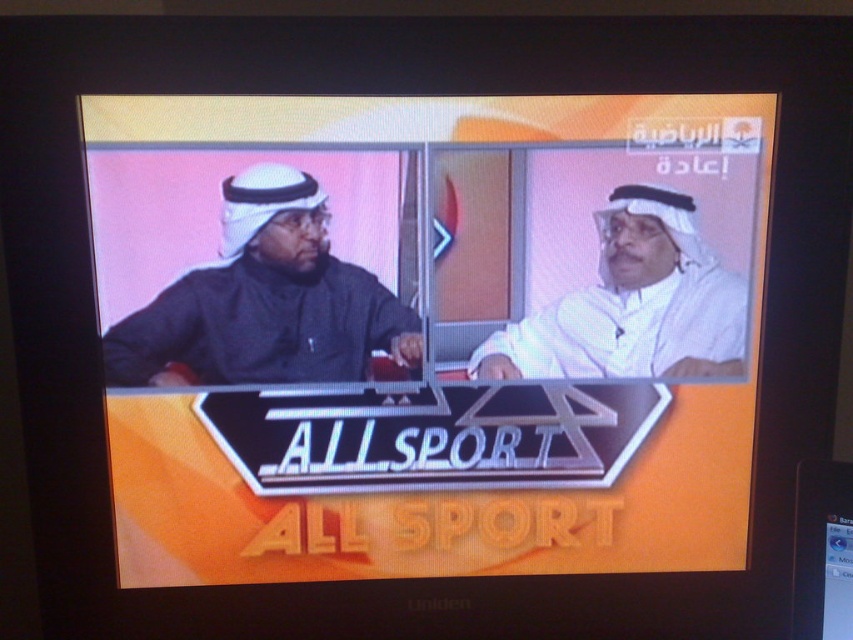
You are designing a display case for cultural artifacts. The case has two compartments. The first compartment must fit the matte black robe at left, and the second must accommodate the white matte headscarf at center. Given their sizes, which compartment should be designed with more space?

The matte black robe at left is larger in size than the white matte headscarf at center, so the first compartment should be designed with more space to accommodate the larger robe.

You are a sports commentator preparing to describe the scene on the TV screen. You notice two items in the image. The first is a white matte headscarf at center, and the second is a black plastic flat at lower right. Which of these items is located to the left of the other?

The white matte headscarf at center is positioned on the left side of black plastic flat at lower right.